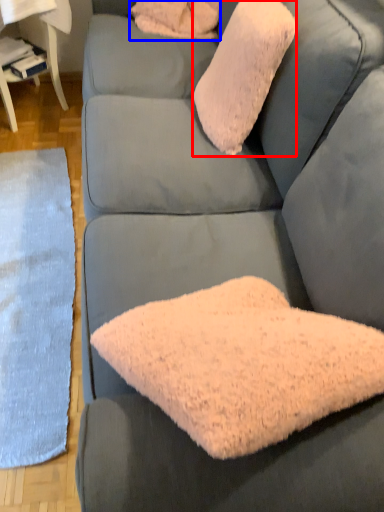
Question: Which point is closer to the camera, throw pillow (highlighted by a red box) or pillow (highlighted by a blue box)?

Choices:
 (A) throw pillow
 (B) pillow

Answer: (A)